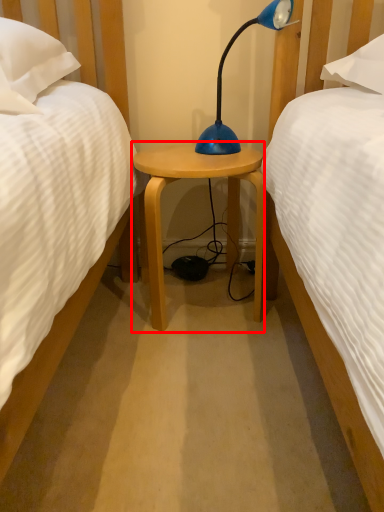
Question: Observing the image, what is the correct spatial positioning of nightstand (annotated by the red box) in reference to lamp?

Choices:
 (A) right
 (B) left

Answer: (B)